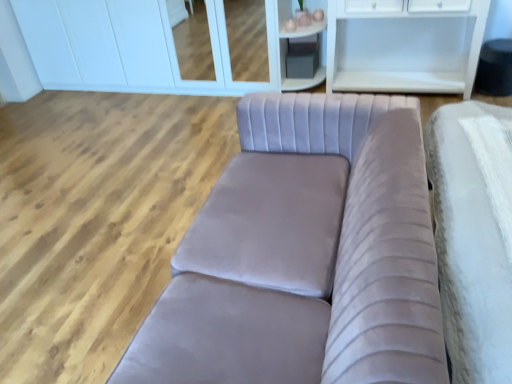
Identify the location of matte gray cube at upper center. (298, 36).

Find the location of a particular element. This screenshot has width=512, height=384. velvet grey couch at center is located at coordinates (305, 255).

Is matte gray cube at upper center with velvet grey couch at center?

matte gray cube at upper center is not next to velvet grey couch at center, and they're not touching.

Considering the relative positions of matte gray cube at upper center and velvet grey couch at center in the image provided, is matte gray cube at upper center to the right of velvet grey couch at center from the viewer's perspective?

Yes, matte gray cube at upper center is to the right of velvet grey couch at center.

Locate an element on the screen. The height and width of the screenshot is (384, 512). studio couch below the matte gray cube at upper center (from a real-world perspective) is located at coordinates (305, 255).

From the picture: Does matte gray cube at upper center turn towards velvet grey couch at center?

Yes, matte gray cube at upper center faces towards velvet grey couch at center.

In the scene shown: Considering the positions of objects velvet grey couch at center and matte gray cube at upper center in the image provided, who is more to the left, velvet grey couch at center or matte gray cube at upper center?

velvet grey couch at center.

In the scene shown: Can you confirm if velvet grey couch at center is bigger than matte gray cube at upper center?

Indeed, velvet grey couch at center has a larger size compared to matte gray cube at upper center.

Locate an element on the screen. The width and height of the screenshot is (512, 384). studio couch that is below the matte gray cube at upper center (from the image's perspective) is located at coordinates click(305, 255).

Does velvet grey couch at center lie in front of matte gray cube at upper center?

Yes, it is.

Can you confirm if matte gray cube at upper center is wider than white glossy cabinet at upper center?

No, matte gray cube at upper center is not wider than white glossy cabinet at upper center.

Consider the image. Is matte gray cube at upper center not within white glossy cabinet at upper center?

Yes, matte gray cube at upper center is located beyond the bounds of white glossy cabinet at upper center.

How far apart are matte gray cube at upper center and white glossy cabinet at upper center?

3.52 feet.

Considering the sizes of objects matte gray cube at upper center and white glossy cabinet at upper center in the image provided, who is smaller, matte gray cube at upper center or white glossy cabinet at upper center?

With smaller size is matte gray cube at upper center.

What's the angular difference between white glossy cabinet at upper center and velvet grey couch at center's facing directions?

white glossy cabinet at upper center and velvet grey couch at center are facing 89.2 degrees away from each other.

Who is taller, white glossy cabinet at upper center or velvet grey couch at center?

Standing taller between the two is white glossy cabinet at upper center.

Considering the relative sizes of white glossy cabinet at upper center and velvet grey couch at center in the image provided, is white glossy cabinet at upper center thinner than velvet grey couch at center?

Correct, the width of white glossy cabinet at upper center is less than that of velvet grey couch at center.

Is white glossy cabinet at upper center positioned behind velvet grey couch at center?

That is True.

Relative to matte gray cube at upper center, is white glossy cabinet at upper center in front or behind?

white glossy cabinet at upper center is behind matte gray cube at upper center.

Could you tell me if white glossy cabinet at upper center is facing matte gray cube at upper center?

No.

From the image's perspective, between white glossy cabinet at upper center and matte gray cube at upper center, which one is located above?

white glossy cabinet at upper center, from the image's perspective.

How far apart are white glossy cabinet at upper center and matte gray cube at upper center?

The distance of white glossy cabinet at upper center from matte gray cube at upper center is 1.07 meters.

Is velvet grey couch at center looking in the opposite direction of white glossy cabinet at upper center?

No, velvet grey couch at center's orientation is not away from white glossy cabinet at upper center.

From the image's perspective, which one is positioned lower, velvet grey couch at center or white glossy cabinet at upper center?

velvet grey couch at center, from the image's perspective.

Considering the positions of point (404, 375) and point (83, 50), is point (404, 375) closer or farther from the camera than point (83, 50)?

Point (404, 375) is closer to the camera than point (83, 50).

Choose the correct answer: Is velvet grey couch at center inside white glossy cabinet at upper center or outside it?

velvet grey couch at center is spatially situated outside white glossy cabinet at upper center.

Where is `studio couch beneath the matte gray cube at upper center (from a real-world perspective)`? studio couch beneath the matte gray cube at upper center (from a real-world perspective) is located at coordinates (305, 255).

Where is `studio couch lying below the matte gray cube at upper center (from the image's perspective)`? Image resolution: width=512 pixels, height=384 pixels. studio couch lying below the matte gray cube at upper center (from the image's perspective) is located at coordinates (305, 255).

Looking at the image, which one is located further to matte gray cube at upper center, velvet grey couch at center or white glossy cabinet at upper center?

velvet grey couch at center is positioned further to the anchor matte gray cube at upper center.

Estimate the real-world distances between objects in this image. Which object is further from velvet grey couch at center, white glossy cabinet at upper center or matte gray cube at upper center?

Based on the image, white glossy cabinet at upper center appears to be further to velvet grey couch at center.

Which object lies nearer to the anchor point matte gray cube at upper center, white glossy cabinet at upper center or velvet grey couch at center?

The object closer to matte gray cube at upper center is white glossy cabinet at upper center.

Considering their positions, is matte gray cube at upper center positioned closer to white glossy cabinet at upper center than velvet grey couch at center?

matte gray cube at upper center is positioned closer to the anchor white glossy cabinet at upper center.

When comparing their distances from white glossy cabinet at upper center, does velvet grey couch at center or matte gray cube at upper center seem closer?

matte gray cube at upper center lies closer to white glossy cabinet at upper center than the other object.

From the image, which object appears to be nearer to velvet grey couch at center, matte gray cube at upper center or white glossy cabinet at upper center?

matte gray cube at upper center is closer to velvet grey couch at center.

Locate an element on the screen. The image size is (512, 384). cabinetry between velvet grey couch at center and white glossy cabinet at upper center in the front-back direction is located at coordinates (298, 36).